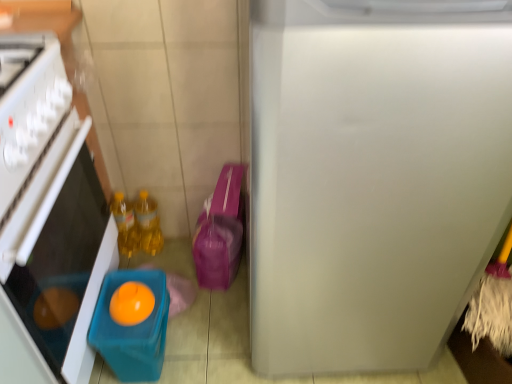
Locate an element on the screen. matte plastic container at lower left is located at coordinates (132, 329).

Where is `white matte refrigerator at right`? white matte refrigerator at right is located at coordinates (373, 176).

The image size is (512, 384). I want to click on translucent plastic container at left, so click(47, 218).

Which is in front, white matte refrigerator at right or translucent yellow bottle at lower left, the first bottle positioned from the left?

Positioned in front is white matte refrigerator at right.

From a real-world perspective, who is located higher, white matte refrigerator at right or translucent yellow bottle at lower left, the first bottle positioned from the left?

In real-world perspective, white matte refrigerator at right is above.

I want to click on bottle that is the 2nd object to the left of the white matte refrigerator at right, starting at the anchor, so click(x=125, y=224).

Which object is positioned more to the left, white matte refrigerator at right or translucent yellow bottle at lower left, the second bottle when ordered from right to left?

From the viewer's perspective, translucent yellow bottle at lower left, the second bottle when ordered from right to left, appears more on the left side.

Considering the sizes of matte plastic container at lower left and translucent yellow bottle at lower left, the second bottle when ordered from right to left, in the image, is matte plastic container at lower left bigger or smaller than translucent yellow bottle at lower left, the second bottle when ordered from right to left,?

In the image, matte plastic container at lower left appears to be larger than translucent yellow bottle at lower left, the second bottle when ordered from right to left.

Considering the points (109, 276) and (123, 223), which point is behind, point (109, 276) or point (123, 223)?

The point (123, 223) is farther.

Which is behind, matte plastic container at lower left or translucent yellow bottle at lower left, the first bottle positioned from the left?

translucent yellow bottle at lower left, the first bottle positioned from the left, is behind.

From a real-world perspective, is translucent yellow bottle at lower left, the first bottle positioned from the left, beneath white matte refrigerator at right?

Yes, from a real-world perspective, translucent yellow bottle at lower left, the first bottle positioned from the left, is beneath white matte refrigerator at right.

Considering the sizes of objects translucent yellow bottle at lower left, the first bottle positioned from the left, and white matte refrigerator at right in the image provided, who is shorter, translucent yellow bottle at lower left, the first bottle positioned from the left, or white matte refrigerator at right?

translucent yellow bottle at lower left, the first bottle positioned from the left.

Considering the sizes of translucent yellow bottle at lower left, the second bottle when ordered from right to left, and white matte refrigerator at right in the image, is translucent yellow bottle at lower left, the second bottle when ordered from right to left, wider or thinner than white matte refrigerator at right?

Clearly, translucent yellow bottle at lower left, the second bottle when ordered from right to left, has less width compared to white matte refrigerator at right.

Considering their positions, is orange matte/orange at lower left located in front of or behind translucent yellow bottle at lower left, the first bottle positioned from the left?

orange matte/orange at lower left is in front of translucent yellow bottle at lower left, the first bottle positioned from the left.

You are a GUI agent. You are given a task and a screenshot of the screen. Output one action in this format:
    pyautogui.click(x=<x>, y=<y>)
    Task: Click on the orange in front of the translucent yellow bottle at lower left, the second bottle when ordered from right to left
    
    Given the screenshot: What is the action you would take?
    pyautogui.click(x=131, y=303)

From the image's perspective, who appears lower, orange matte/orange at lower left or translucent yellow bottle at lower left, the second bottle when ordered from right to left?

orange matte/orange at lower left appears lower in the image.

Could you tell me if orange matte/orange at lower left is facing translucent yellow bottle at lower left, the first bottle positioned from the left?

No, orange matte/orange at lower left is not turned towards translucent yellow bottle at lower left, the first bottle positioned from the left.

Does yellow translucent bottles at center, which is the 1th bottle in right-to-left order, have a greater width compared to matte plastic container at lower left?

Incorrect, the width of yellow translucent bottles at center, which is the 1th bottle in right-to-left order, does not surpass that of matte plastic container at lower left.

Is yellow translucent bottles at center, which is the 1th bottle in right-to-left order, aimed at matte plastic container at lower left?

Yes, yellow translucent bottles at center, which is the 1th bottle in right-to-left order, is facing matte plastic container at lower left.

Is yellow translucent bottles at center, which is the 1th bottle in right-to-left order, bigger or smaller than matte plastic container at lower left?

In the image, yellow translucent bottles at center, which is the 1th bottle in right-to-left order, appears to be smaller than matte plastic container at lower left.

Does point (113, 304) come farther from viewer compared to point (156, 207)?

No, it is not.

From the image's perspective, which object appears higher, orange matte/orange at lower left or yellow translucent bottles at center, which is the second bottle in left-to-right order?

yellow translucent bottles at center, which is the second bottle in left-to-right order, appears higher in the image.

Does orange matte/orange at lower left appear on the right side of yellow translucent bottles at center, which is the second bottle in left-to-right order?

Yes.

Can you tell me how much orange matte/orange at lower left and yellow translucent bottles at center, which is the 1th bottle in right-to-left order, differ in facing direction?

They differ by 2.67 degrees in their facing directions.

In the scene shown: Does translucent plastic container at left have a greater width compared to orange matte/orange at lower left?

Yes, translucent plastic container at left is wider than orange matte/orange at lower left.

This screenshot has width=512, height=384. What are the coordinates of `home appliance on the left of orange matte/orange at lower left` in the screenshot? It's located at (47, 218).

Is orange matte/orange at lower left completely or partially inside translucent plastic container at left?

No, orange matte/orange at lower left is not a part of translucent plastic container at left.

Between translucent plastic container at left and orange matte/orange at lower left, which one has more height?

translucent plastic container at left is taller.

Identify the location of refrigerator on the right of translucent yellow bottle at lower left, the first bottle positioned from the left. (373, 176).

Find the location of a particular element. toy that appears below the translucent yellow bottle at lower left, the first bottle positioned from the left (from a real-world perspective) is located at coordinates (132, 329).

Estimate the real-world distances between objects in this image. Which object is further from yellow translucent bottles at center, which is the 1th bottle in right-to-left order, matte plastic container at lower left or white matte refrigerator at right?

white matte refrigerator at right lies further to yellow translucent bottles at center, which is the 1th bottle in right-to-left order, than the other object.

From the image, which object appears to be farther from white matte refrigerator at right, yellow translucent bottles at center, which is the 1th bottle in right-to-left order, or translucent yellow bottle at lower left, the first bottle positioned from the left?

translucent yellow bottle at lower left, the first bottle positioned from the left, is positioned further to the anchor white matte refrigerator at right.

Which object lies nearer to the anchor point white matte refrigerator at right, translucent yellow bottle at lower left, the first bottle positioned from the left, or yellow translucent bottles at center, which is the second bottle in left-to-right order?

Based on the image, yellow translucent bottles at center, which is the second bottle in left-to-right order, appears to be nearer to white matte refrigerator at right.

From the image, which object appears to be nearer to orange matte/orange at lower left, yellow translucent bottles at center, which is the 1th bottle in right-to-left order, or matte plastic container at lower left?

matte plastic container at lower left.

Estimate the real-world distances between objects in this image. Which object is further from translucent yellow bottle at lower left, the first bottle positioned from the left, white matte refrigerator at right or orange matte/orange at lower left?

Among the two, white matte refrigerator at right is located further to translucent yellow bottle at lower left, the first bottle positioned from the left.

Considering their positions, is white matte refrigerator at right positioned further to yellow translucent bottles at center, which is the second bottle in left-to-right order, than matte plastic container at lower left?

Based on the image, white matte refrigerator at right appears to be further to yellow translucent bottles at center, which is the second bottle in left-to-right order.

Considering their positions, is translucent yellow bottle at lower left, the second bottle when ordered from right to left, positioned further to orange matte/orange at lower left than matte plastic container at lower left?

translucent yellow bottle at lower left, the second bottle when ordered from right to left, is further to orange matte/orange at lower left.

When comparing their distances from matte plastic container at lower left, does orange matte/orange at lower left or yellow translucent bottles at center, which is the second bottle in left-to-right order, seem further?

yellow translucent bottles at center, which is the second bottle in left-to-right order, is further to matte plastic container at lower left.

This screenshot has width=512, height=384. Find the location of `home appliance between white matte refrigerator at right and translucent yellow bottle at lower left, the second bottle when ordered from right to left, along the z-axis`. home appliance between white matte refrigerator at right and translucent yellow bottle at lower left, the second bottle when ordered from right to left, along the z-axis is located at coordinates (47, 218).

This screenshot has height=384, width=512. Find the location of `orange between translucent plastic container at left and translucent yellow bottle at lower left, the first bottle positioned from the left, in the front-back direction`. orange between translucent plastic container at left and translucent yellow bottle at lower left, the first bottle positioned from the left, in the front-back direction is located at coordinates (131, 303).

Identify the location of toy positioned between white matte refrigerator at right and yellow translucent bottles at center, which is the 1th bottle in right-to-left order, from near to far. (132, 329).

This screenshot has width=512, height=384. What are the coordinates of `bottle between orange matte/orange at lower left and yellow translucent bottles at center, which is the 1th bottle in right-to-left order, along the z-axis` in the screenshot? It's located at (125, 224).